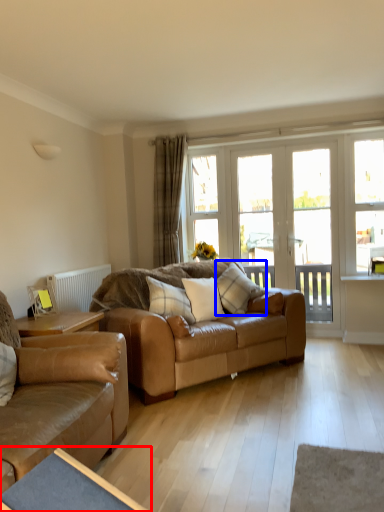
Question: Which object appears farthest to the camera in this image, table (highlighted by a red box) or pillow (highlighted by a blue box)?

Choices:
 (A) table
 (B) pillow

Answer: (B)